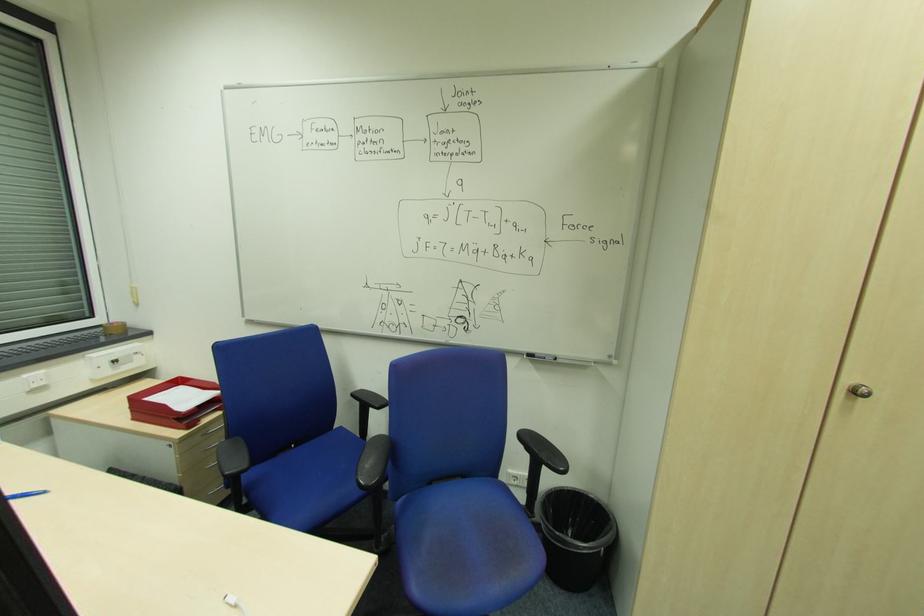
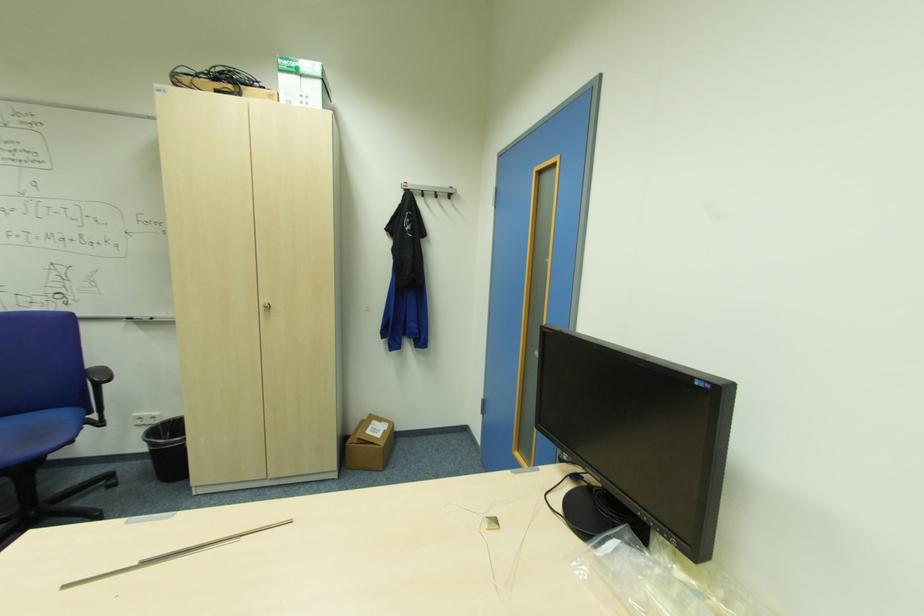
In a continuous first-person perspective shot, in which direction is the camera moving?

The movement direction of the cameraman is right, backward.